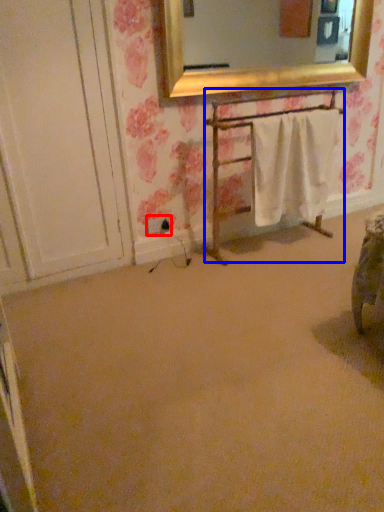
Question: Among these objects, which one is nearest to the camera, electric outlet (highlighted by a red box) or furniture (highlighted by a blue box)?

Choices:
 (A) electric outlet
 (B) furniture

Answer: (B)